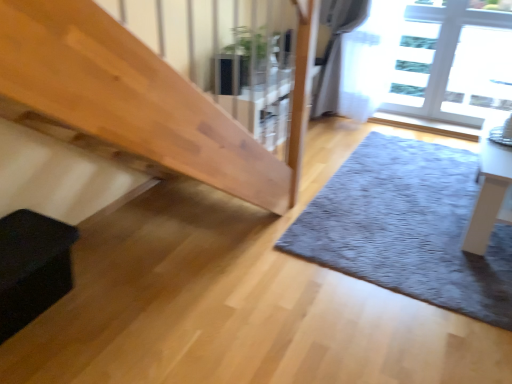
Question: Choose the correct answer: Is black matte box at lower left inside white glossy table at right or outside it?

Choices:
 (A) outside
 (B) inside

Answer: (A)

Question: Is point (10, 317) closer or farther from the camera than point (502, 200)?

Choices:
 (A) closer
 (B) farther

Answer: (A)

Question: Which object is positioned farthest from the green glossy plant at upper center?

Choices:
 (A) transparent glass window at upper right
 (B) white glossy table at right
 (C) gray shaggy rug at lower right
 (D) black matte box at lower left

Answer: (D)

Question: Estimate the real-world distances between objects in this image. Which object is farther from the black matte box at lower left?

Choices:
 (A) white glossy table at right
 (B) transparent glass window at upper right
 (C) green glossy plant at upper center
 (D) gray shaggy rug at lower right

Answer: (B)